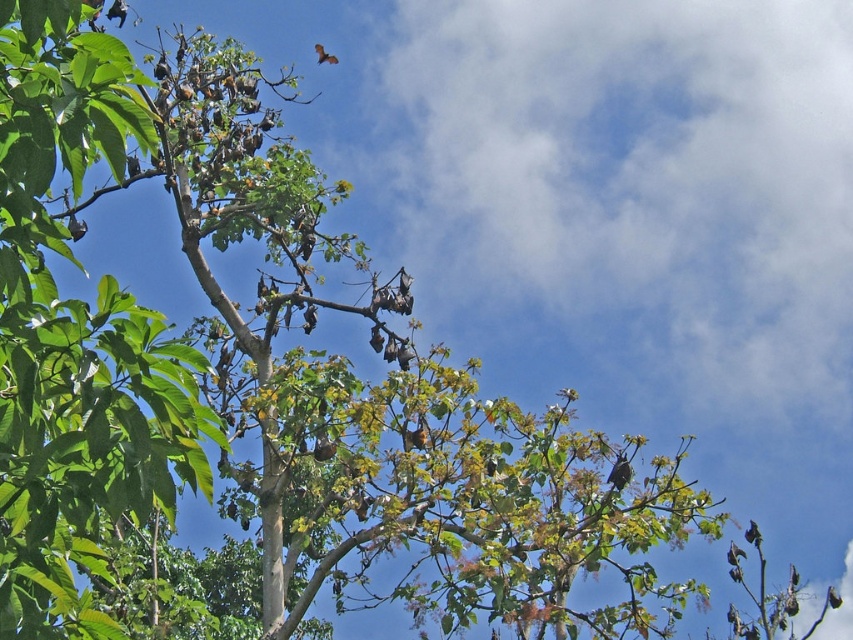
You are a birdwatcher observing the scene. You notice a shiny black bird at center and a brown fuzzy bat at upper center. Which of these two creatures is taller?

The shiny black bird at center is taller than the brown fuzzy bat at upper center.

You are a bird flying at an altitude of 30 feet. You see the brown fuzzy bat at upper center and the dark brown feathers at upper right in the image. Can you safely pass between them without hitting either?

The brown fuzzy bat at upper center and dark brown feathers at upper right are 29.51 feet apart. Since the distance between them is less than your altitude of 30 feet, you can safely pass between them without hitting either.